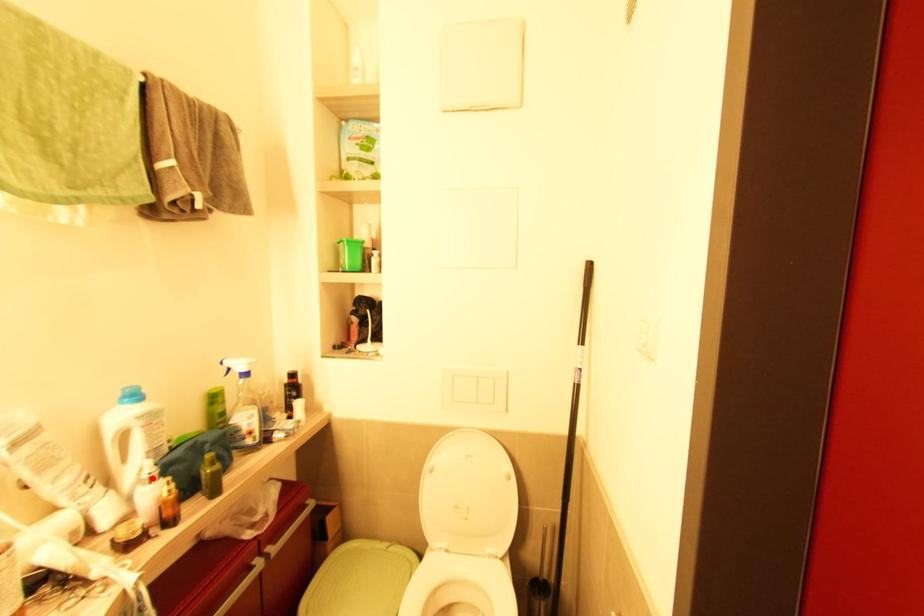
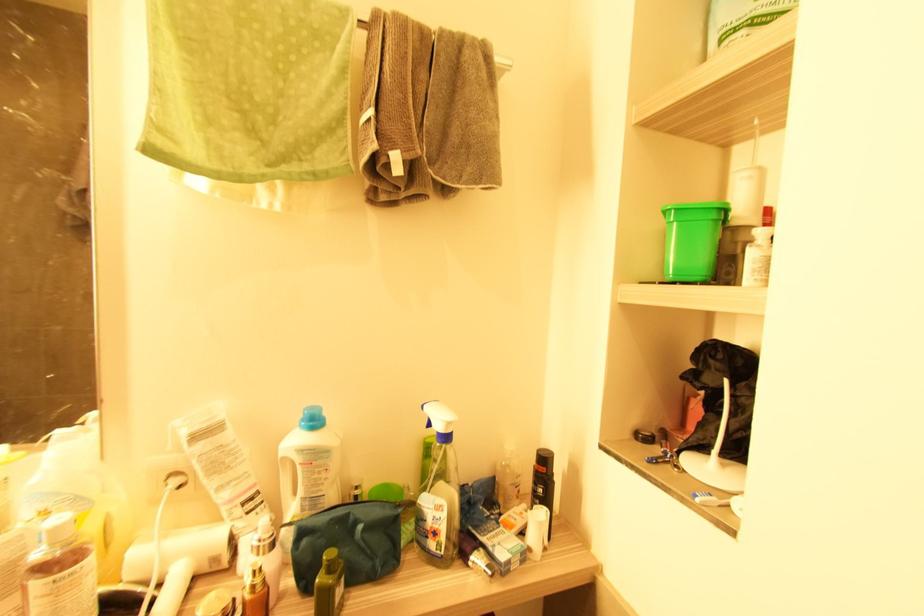
Where in the second image is the point corresponding to the highlighted location from the first image?

(261, 546)